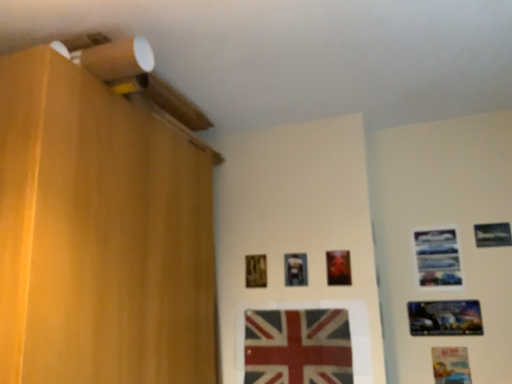
Looking at this image, measure the distance between point (329, 275) and camera.

They are 6.16 feet apart.

The height and width of the screenshot is (384, 512). Describe the element at coordinates (338, 267) in the screenshot. I see `wooden picture frame at center, which is counted as the 5th picture frame, starting from the right` at that location.

Locate an element on the screen. red fabric flag at center is located at coordinates click(297, 346).

Measure the distance between metallic silver picture frame at upper right, the first picture frame in the right-to-left sequence, and camera.

The distance of metallic silver picture frame at upper right, the first picture frame in the right-to-left sequence, from camera is 6.22 feet.

Describe the element at coordinates (296, 269) in the screenshot. I see `metallic silver picture frame at center, placed as the sixth picture frame when sorted from right to left` at that location.

This screenshot has width=512, height=384. Identify the location of wooden picture frame at center, acting as the first picture frame starting from the left. (256, 271).

This screenshot has width=512, height=384. What do you see at coordinates (437, 257) in the screenshot?
I see `metallic silver picture frame at upper right, which ranks as the fourth picture frame in right-to-left order` at bounding box center [437, 257].

The image size is (512, 384). What do you see at coordinates (445, 318) in the screenshot?
I see `metallic reflective poster at lower right, placed as the 5th picture frame when sorted from left to right` at bounding box center [445, 318].

What is the approximate width of matte plastic picture frame at lower right, which is counted as the sixth picture frame, starting from the left?

matte plastic picture frame at lower right, which is counted as the sixth picture frame, starting from the left, is 0.39 inches wide.

What do you see at coordinates (451, 365) in the screenshot?
I see `matte plastic picture frame at lower right, which is counted as the sixth picture frame, starting from the left` at bounding box center [451, 365].

This screenshot has width=512, height=384. What are the coordinates of `wooden picture frame at center, which is counted as the 5th picture frame, starting from the right` in the screenshot? It's located at (338, 267).

Considering the sizes of metallic reflective poster at lower right, marked as the third picture frame in a right-to-left arrangement, and wooden picture frame at center, which appears as the 3th picture frame when viewed from the left, in the image, is metallic reflective poster at lower right, marked as the third picture frame in a right-to-left arrangement, wider or thinner than wooden picture frame at center, which appears as the 3th picture frame when viewed from the left,?

In the image, metallic reflective poster at lower right, marked as the third picture frame in a right-to-left arrangement, appears to be more narrow than wooden picture frame at center, which appears as the 3th picture frame when viewed from the left.

Is metallic reflective poster at lower right, marked as the third picture frame in a right-to-left arrangement, far from wooden picture frame at center, which appears as the 3th picture frame when viewed from the left?

They are positioned close to each other.

From the picture: Is metallic reflective poster at lower right, placed as the 5th picture frame when sorted from left to right, taller or shorter than wooden picture frame at center, which is counted as the 5th picture frame, starting from the right?

metallic reflective poster at lower right, placed as the 5th picture frame when sorted from left to right, is shorter than wooden picture frame at center, which is counted as the 5th picture frame, starting from the right.

Considering the positions of objects red fabric flag at center and metallic silver picture frame at center, placed as the sixth picture frame when sorted from right to left, in the image provided, who is behind, red fabric flag at center or metallic silver picture frame at center, placed as the sixth picture frame when sorted from right to left,?

metallic silver picture frame at center, placed as the sixth picture frame when sorted from right to left.

Measure the distance from red fabric flag at center to metallic silver picture frame at center, placed as the sixth picture frame when sorted from right to left.

A distance of 10.58 inches exists between red fabric flag at center and metallic silver picture frame at center, placed as the sixth picture frame when sorted from right to left.

I want to click on flag lying below the metallic silver picture frame at center, the second picture frame from the left (from the image's perspective), so click(x=297, y=346).

Is point (323, 382) positioned after point (306, 278)?

No, it is in front of (306, 278).

From a real-world perspective, is metallic silver picture frame at center, the second picture frame from the left, positioned under matte plastic picture frame at lower right, which is counted as the sixth picture frame, starting from the left, based on gravity?

Actually, metallic silver picture frame at center, the second picture frame from the left, is physically above matte plastic picture frame at lower right, which is counted as the sixth picture frame, starting from the left, in the real world.

Is metallic silver picture frame at center, placed as the sixth picture frame when sorted from right to left, oriented towards matte plastic picture frame at lower right, arranged as the second picture frame when viewed from the right?

No, metallic silver picture frame at center, placed as the sixth picture frame when sorted from right to left, does not turn towards matte plastic picture frame at lower right, arranged as the second picture frame when viewed from the right.

Which point is more distant from viewer, [298,256] or [454,378]?

Point [298,256]

Which object is further away from the camera, metallic silver picture frame at center, placed as the sixth picture frame when sorted from right to left, or metallic silver picture frame at upper right, the 7th picture frame viewed from the left?

metallic silver picture frame at upper right, the 7th picture frame viewed from the left.

Is metallic silver picture frame at center, placed as the sixth picture frame when sorted from right to left, to the left of metallic silver picture frame at upper right, the 7th picture frame viewed from the left, from the viewer's perspective?

Yes.

Is metallic silver picture frame at center, placed as the sixth picture frame when sorted from right to left, not close to metallic silver picture frame at upper right, the 7th picture frame viewed from the left?

No, metallic silver picture frame at center, placed as the sixth picture frame when sorted from right to left, is not far from metallic silver picture frame at upper right, the 7th picture frame viewed from the left.

From a real-world perspective, is metallic silver picture frame at center, the second picture frame from the left, physically located above or below metallic silver picture frame at upper right, the 7th picture frame viewed from the left?

In terms of real-world spatial position, metallic silver picture frame at center, the second picture frame from the left, is below metallic silver picture frame at upper right, the 7th picture frame viewed from the left.

Is matte plastic picture frame at lower right, arranged as the second picture frame when viewed from the right, touching red fabric flag at center?

No, matte plastic picture frame at lower right, arranged as the second picture frame when viewed from the right, is not with red fabric flag at center.

Considering the positions of objects matte plastic picture frame at lower right, which is counted as the sixth picture frame, starting from the left, and red fabric flag at center in the image provided, who is more to the left, matte plastic picture frame at lower right, which is counted as the sixth picture frame, starting from the left, or red fabric flag at center?

red fabric flag at center.

Which is behind, point (441, 358) or point (281, 332)?

Point (441, 358)

What's the angular difference between matte plastic picture frame at lower right, which is counted as the sixth picture frame, starting from the left, and red fabric flag at center's facing directions?

There is a 0.676-degree angle between the facing directions of matte plastic picture frame at lower right, which is counted as the sixth picture frame, starting from the left, and red fabric flag at center.

Is matte plastic picture frame at lower right, arranged as the second picture frame when viewed from the right, wider or thinner than metallic silver picture frame at upper right, which ranks as the fourth picture frame in right-to-left order?

Considering their sizes, matte plastic picture frame at lower right, arranged as the second picture frame when viewed from the right, looks slimmer than metallic silver picture frame at upper right, which ranks as the fourth picture frame in right-to-left order.

Is matte plastic picture frame at lower right, arranged as the second picture frame when viewed from the right, positioned beyond the bounds of metallic silver picture frame at upper right, marked as the fourth picture frame in a left-to-right arrangement?

Yes, matte plastic picture frame at lower right, arranged as the second picture frame when viewed from the right, is not within metallic silver picture frame at upper right, marked as the fourth picture frame in a left-to-right arrangement.

Considering the sizes of objects matte plastic picture frame at lower right, arranged as the second picture frame when viewed from the right, and metallic silver picture frame at upper right, marked as the fourth picture frame in a left-to-right arrangement, in the image provided, who is smaller, matte plastic picture frame at lower right, arranged as the second picture frame when viewed from the right, or metallic silver picture frame at upper right, marked as the fourth picture frame in a left-to-right arrangement,?

With smaller size is matte plastic picture frame at lower right, arranged as the second picture frame when viewed from the right.

Visually, is matte plastic picture frame at lower right, arranged as the second picture frame when viewed from the right, positioned to the left or to the right of metallic silver picture frame at upper right, marked as the fourth picture frame in a left-to-right arrangement?

matte plastic picture frame at lower right, arranged as the second picture frame when viewed from the right, is positioned on metallic silver picture frame at upper right, marked as the fourth picture frame in a left-to-right arrangement,'s right side.

Measure the distance between metallic reflective poster at lower right, placed as the 5th picture frame when sorted from left to right, and metallic silver picture frame at center, placed as the sixth picture frame when sorted from right to left.

24.28 inches.

Which of these two, metallic reflective poster at lower right, placed as the 5th picture frame when sorted from left to right, or metallic silver picture frame at center, the second picture frame from the left, is smaller?

metallic silver picture frame at center, the second picture frame from the left, is smaller.

Considering the relative sizes of metallic reflective poster at lower right, marked as the third picture frame in a right-to-left arrangement, and metallic silver picture frame at center, the second picture frame from the left, in the image provided, is metallic reflective poster at lower right, marked as the third picture frame in a right-to-left arrangement, shorter than metallic silver picture frame at center, the second picture frame from the left,?

Yes.

Considering the positions of points (459, 306) and (303, 282), is point (459, 306) farther from camera compared to point (303, 282)?

Yes, it is behind point (303, 282).

Which picture frame is the 1st one when counting from the front of the metallic reflective poster at lower right, marked as the third picture frame in a right-to-left arrangement? Please provide its 2D coordinates.

[(338, 267)]

I want to click on flag beneath the metallic silver picture frame at center, placed as the sixth picture frame when sorted from right to left (from a real-world perspective), so click(297, 346).

When comparing their distances from metallic reflective poster at lower right, marked as the third picture frame in a right-to-left arrangement, does metallic silver picture frame at upper right, the 7th picture frame viewed from the left, or matte plastic picture frame at lower right, which is counted as the sixth picture frame, starting from the left, seem further?

metallic silver picture frame at upper right, the 7th picture frame viewed from the left, is further to metallic reflective poster at lower right, marked as the third picture frame in a right-to-left arrangement.

Estimate the real-world distances between objects in this image. Which object is closer to wooden picture frame at center, which appears as the 3th picture frame when viewed from the left, metallic silver picture frame at upper right, marked as the fourth picture frame in a left-to-right arrangement, or metallic silver picture frame at upper right, the first picture frame in the right-to-left sequence?

metallic silver picture frame at upper right, marked as the fourth picture frame in a left-to-right arrangement, lies closer to wooden picture frame at center, which appears as the 3th picture frame when viewed from the left, than the other object.

From the image, which object appears to be nearer to metallic reflective poster at lower right, placed as the 5th picture frame when sorted from left to right, matte plastic picture frame at lower right, arranged as the second picture frame when viewed from the right, or metallic silver picture frame at center, the second picture frame from the left?

Based on the image, matte plastic picture frame at lower right, arranged as the second picture frame when viewed from the right, appears to be nearer to metallic reflective poster at lower right, placed as the 5th picture frame when sorted from left to right.

When comparing their distances from metallic silver picture frame at center, the second picture frame from the left, does matte plastic picture frame at lower right, arranged as the second picture frame when viewed from the right, or metallic silver picture frame at upper right, marked as the fourth picture frame in a left-to-right arrangement, seem further?

matte plastic picture frame at lower right, arranged as the second picture frame when viewed from the right, is further to metallic silver picture frame at center, the second picture frame from the left.

When comparing their distances from wooden picture frame at center, which appears as the 3th picture frame when viewed from the left, does red fabric flag at center or matte plastic picture frame at lower right, which is counted as the sixth picture frame, starting from the left, seem further?

The object further to wooden picture frame at center, which appears as the 3th picture frame when viewed from the left, is matte plastic picture frame at lower right, which is counted as the sixth picture frame, starting from the left.

Estimate the real-world distances between objects in this image. Which object is further from red fabric flag at center, matte plastic picture frame at lower right, which is counted as the sixth picture frame, starting from the left, or wooden picture frame at center, acting as the first picture frame starting from the left?

Among the two, matte plastic picture frame at lower right, which is counted as the sixth picture frame, starting from the left, is located further to red fabric flag at center.

Looking at the image, which one is located closer to metallic silver picture frame at upper right, the 7th picture frame viewed from the left, metallic silver picture frame at center, placed as the sixth picture frame when sorted from right to left, or matte plastic picture frame at lower right, arranged as the second picture frame when viewed from the right?

Based on the image, matte plastic picture frame at lower right, arranged as the second picture frame when viewed from the right, appears to be nearer to metallic silver picture frame at upper right, the 7th picture frame viewed from the left.

In the scene shown: When comparing their distances from wooden picture frame at center, acting as the first picture frame starting from the left, does metallic reflective poster at lower right, marked as the third picture frame in a right-to-left arrangement, or metallic silver picture frame at upper right, which ranks as the fourth picture frame in right-to-left order, seem further?

Among the two, metallic reflective poster at lower right, marked as the third picture frame in a right-to-left arrangement, is located further to wooden picture frame at center, acting as the first picture frame starting from the left.

Locate an element on the screen. This screenshot has width=512, height=384. flag situated between wooden picture frame at center, the seventh picture frame positioned from the right, and metallic reflective poster at lower right, marked as the third picture frame in a right-to-left arrangement, from left to right is located at coordinates (297, 346).

Where is `picture frame between wooden picture frame at center, the seventh picture frame positioned from the right, and wooden picture frame at center, which is counted as the 5th picture frame, starting from the right, from left to right`? This screenshot has width=512, height=384. picture frame between wooden picture frame at center, the seventh picture frame positioned from the right, and wooden picture frame at center, which is counted as the 5th picture frame, starting from the right, from left to right is located at coordinates (296, 269).

Image resolution: width=512 pixels, height=384 pixels. I want to click on flag between wooden picture frame at center, the seventh picture frame positioned from the right, and metallic silver picture frame at upper right, the 7th picture frame viewed from the left, from left to right, so click(297, 346).

I want to click on flag between wooden picture frame at center, acting as the first picture frame starting from the left, and metallic silver picture frame at upper right, which ranks as the fourth picture frame in right-to-left order, in the horizontal direction, so click(297, 346).